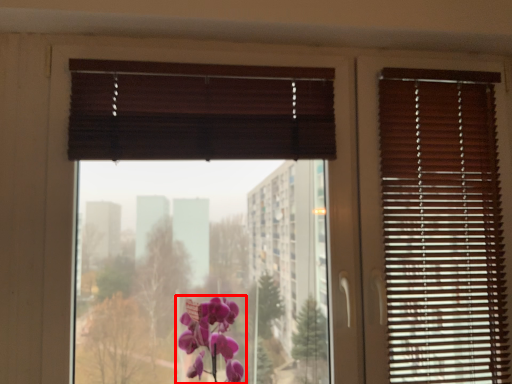
Question: From the image's perspective, what is the correct spatial positioning of flower (annotated by the red box) in reference to window screen?

Choices:
 (A) below
 (B) above

Answer: (A)